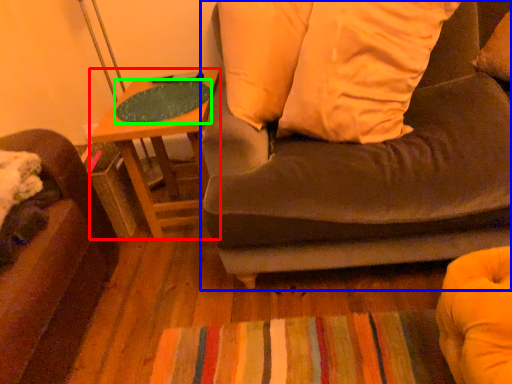
Question: Estimate the real-world distances between objects in this image. Which object is closer to table (highlighted by a red box), studio couch (highlighted by a blue box) or table top (highlighted by a green box)?

Choices:
 (A) studio couch
 (B) table top

Answer: (B)